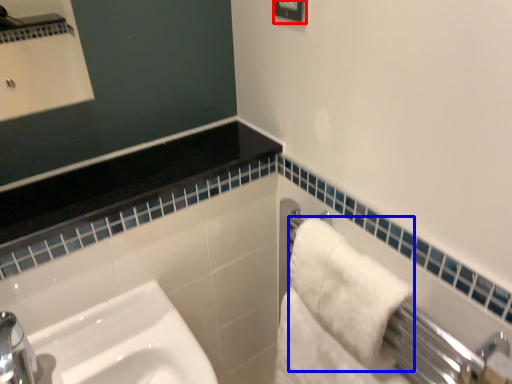
Question: Which point is further to the camera, square (highlighted by a red box) or bath towel (highlighted by a blue box)?

Choices:
 (A) square
 (B) bath towel

Answer: (A)